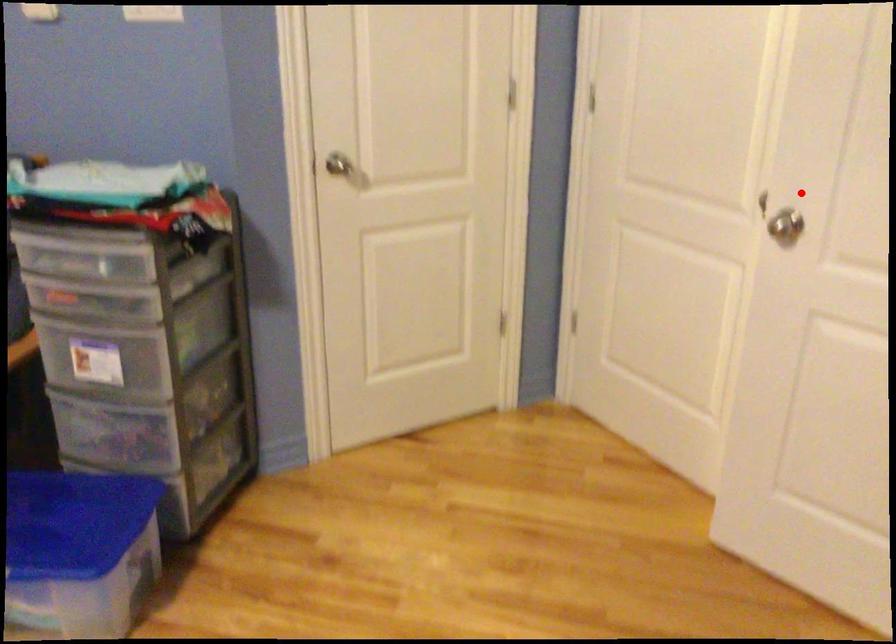
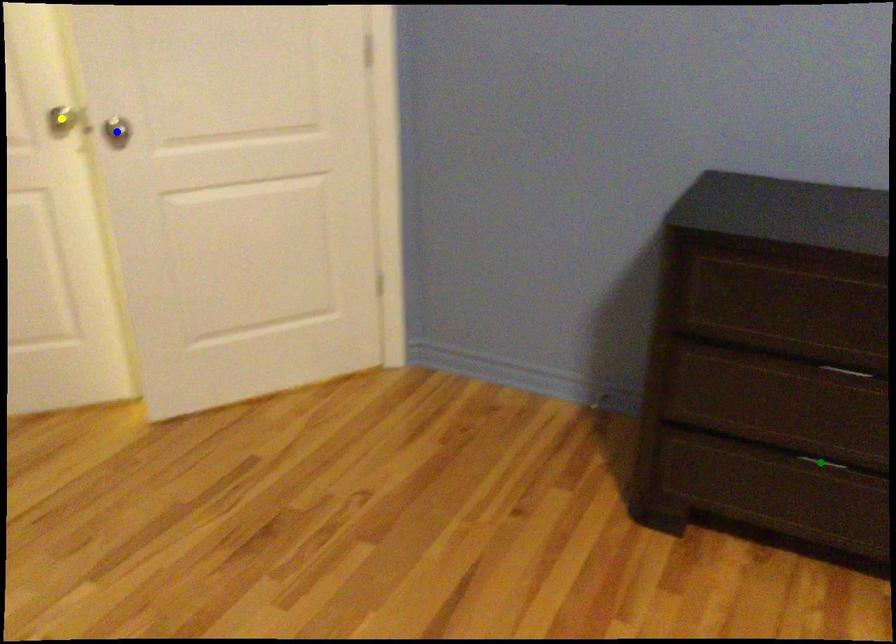
Question: I am providing you with two images of the same scene from different viewpoints. A red point is marked on the first image. You are given multiple points on the second image. Can you choose the point in image 2 that corresponds to the point in image 1?

Choices:
 (A) yellow point
 (B) green point
 (C) blue point

Answer: (A)